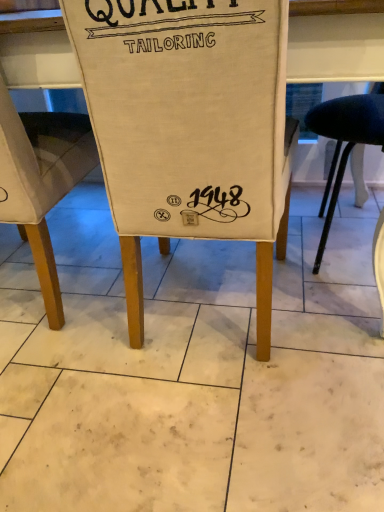
Locate an element on the screen. free space in front of canvas bag at center, positioned as the 1th chair in right-to-left order is located at coordinates (210, 434).